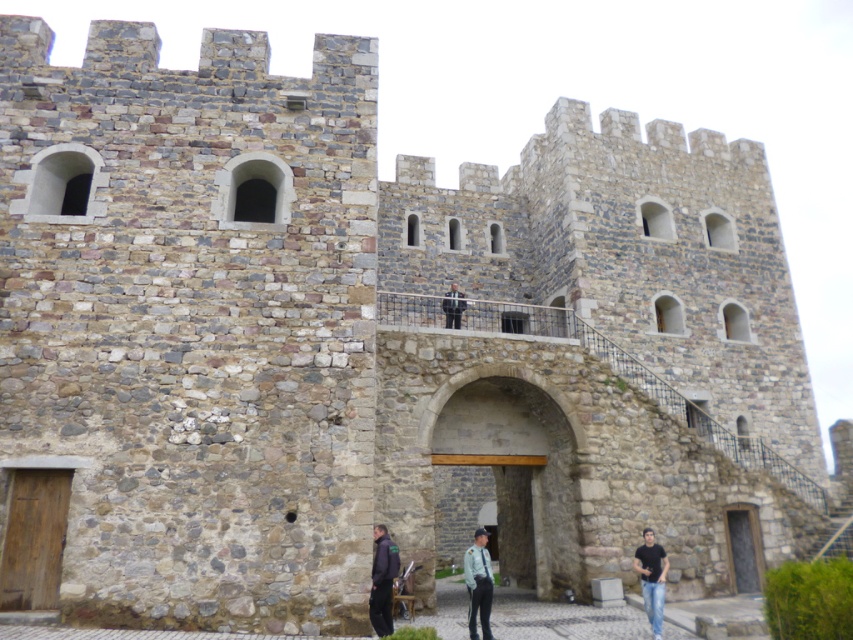
Question: Among these points, which one is farthest from the camera?

Choices:
 (A) (735, 518)
 (B) (380, 618)
 (C) (608, 628)
 (D) (459, 291)

Answer: (D)

Question: Which object is the closest to the jeans at center?

Choices:
 (A) light blue uniform at center
 (B) dark gray suit at center
 (C) dark gray fabric jacket at lower center

Answer: (A)

Question: Does stone archway at center appear under dark gray fabric jacket at lower center?

Choices:
 (A) no
 (B) yes

Answer: (B)

Question: Does jeans at center have a larger size compared to dark gray suit at center?

Choices:
 (A) yes
 (B) no

Answer: (A)

Question: Can you confirm if dark gray fabric jacket at lower center is positioned below dark gray suit at center?

Choices:
 (A) yes
 (B) no

Answer: (A)

Question: Among these points, which one is nearest to the camera?

Choices:
 (A) (648, 560)
 (B) (462, 294)

Answer: (A)